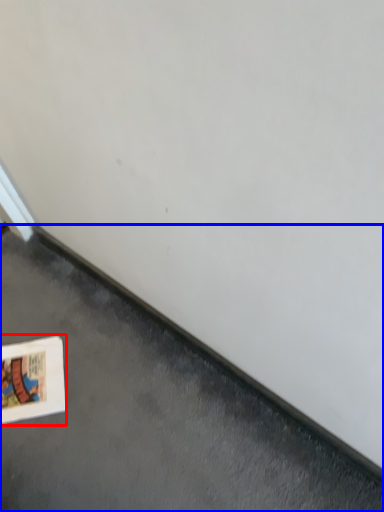
Question: Which object appears farthest to the camera in this image, picture frame (highlighted by a red box) or concrete (highlighted by a blue box)?

Choices:
 (A) picture frame
 (B) concrete

Answer: (A)